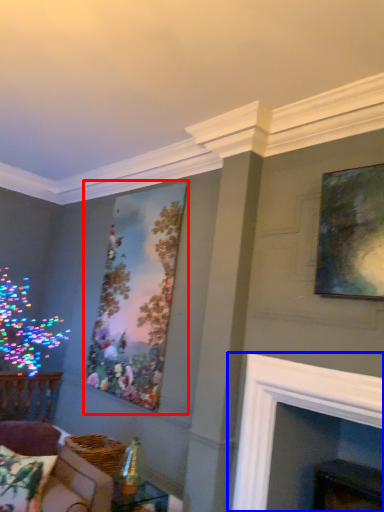
Question: Which of the following is the closest to the observer, picture frame (highlighted by a red box) or fireplace (highlighted by a blue box)?

Choices:
 (A) picture frame
 (B) fireplace

Answer: (B)